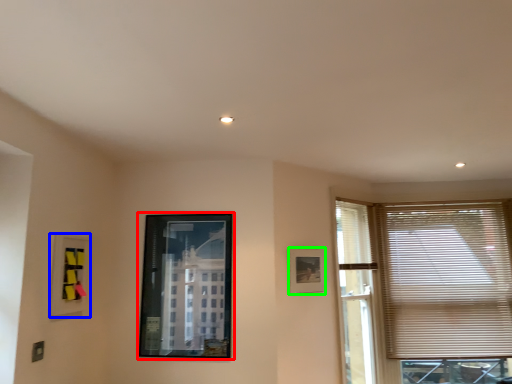
Question: Based on their relative distances, which object is farther from picture frame (highlighted by a red box)? Choose from picture frame (highlighted by a blue box) and picture frame (highlighted by a green box).

Choices:
 (A) picture frame
 (B) picture frame

Answer: (B)